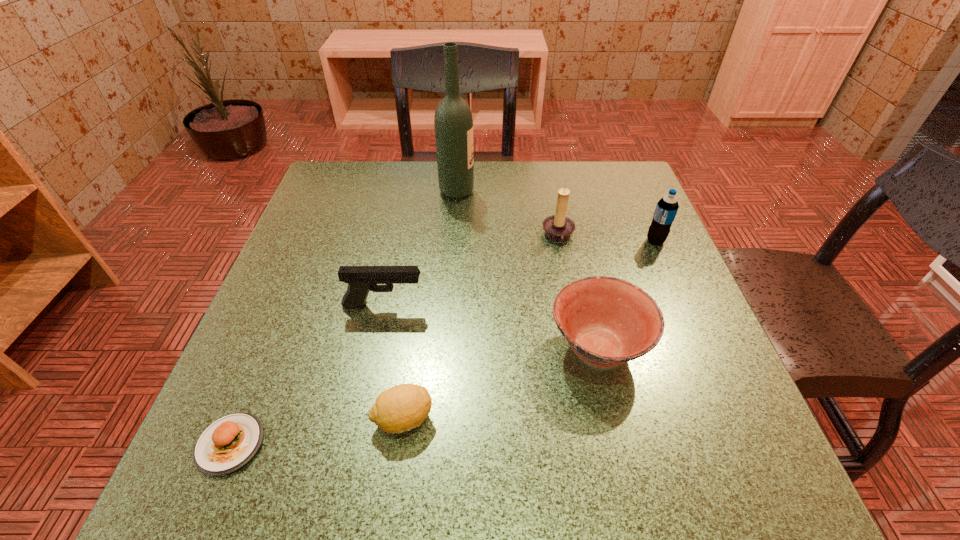
At what (x,y) coordinates should I click in order to perform the action: click on the farthest object. Please return your answer as a coordinate pair (x, y). The height and width of the screenshot is (540, 960). Looking at the image, I should click on (453, 122).

Identify the location of wine bottle. (453, 122).

Image resolution: width=960 pixels, height=540 pixels. What are the coordinates of `soda bottle` in the screenshot? It's located at (667, 207).

Find the location of a particular element. candle holder is located at coordinates (558, 227).

Find the location of a particular element. The image size is (960, 540). the fourth nearest object is located at coordinates (361, 279).

Where is `bowl`? This screenshot has width=960, height=540. bowl is located at coordinates (607, 321).

The height and width of the screenshot is (540, 960). What are the coordinates of `the sixth tallest object` in the screenshot? It's located at (403, 407).

Locate an element on the screen. This screenshot has height=540, width=960. food is located at coordinates (226, 445).

Identify the location of the leftmost object. The width and height of the screenshot is (960, 540). (226, 445).

Find the location of `free spot located on the labeled side of the wine bottle`. free spot located on the labeled side of the wine bottle is located at coordinates (623, 191).